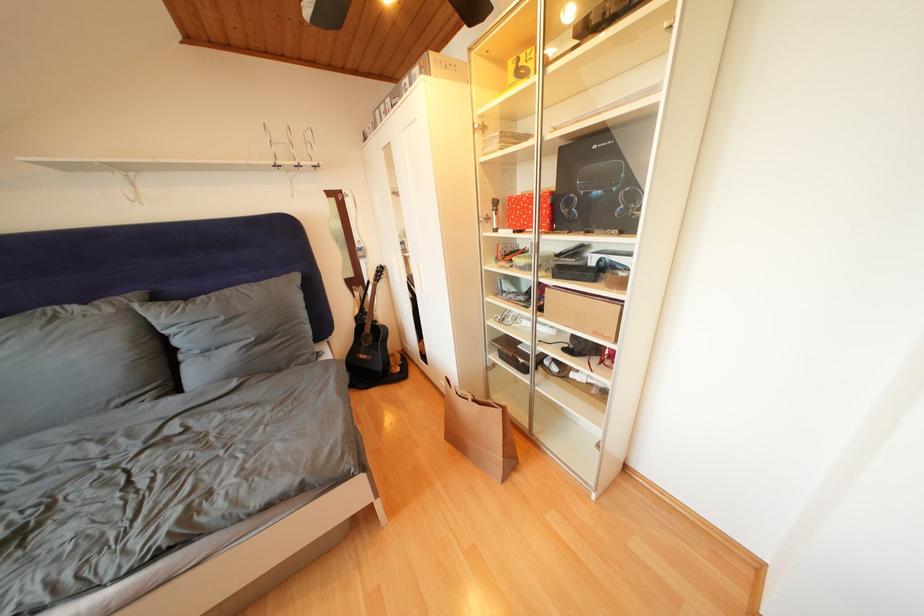
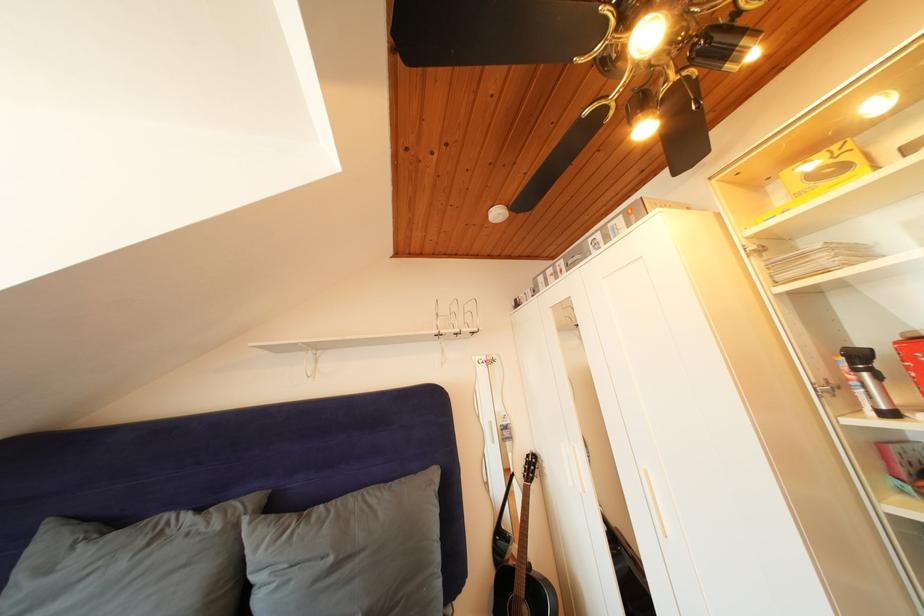
Locate, in the second image, the point that corresponds to point (304, 169) in the first image.

(466, 336)